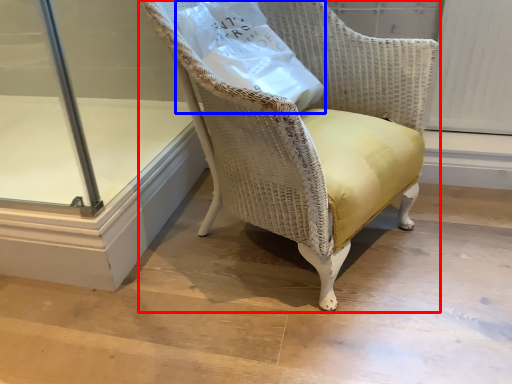
Question: Among these objects, which one is nearest to the camera, chair (highlighted by a red box) or paper bag (highlighted by a blue box)?

Choices:
 (A) chair
 (B) paper bag

Answer: (A)